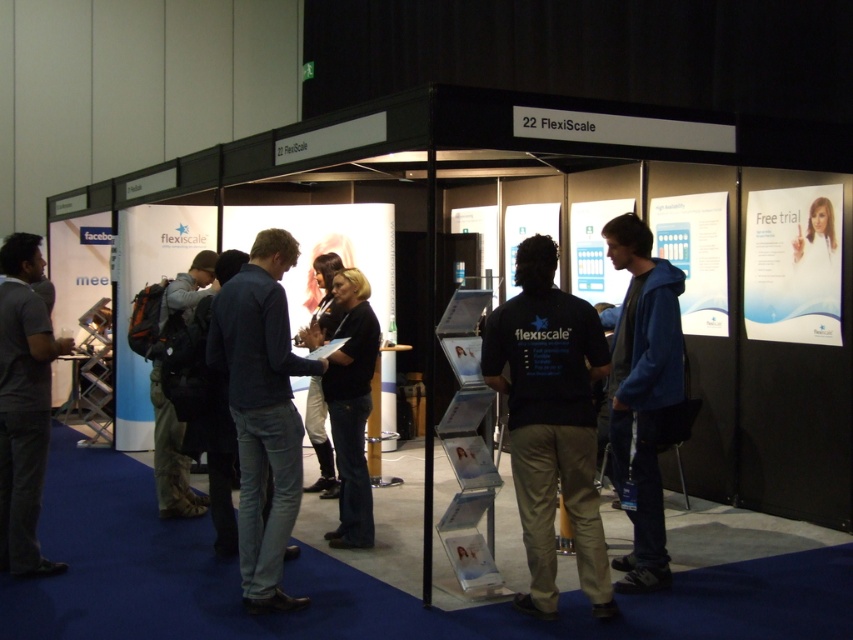
You are a photographer at the trade show and need to take a photo of the FlexiScale booth. The black cotton shirt at center and dark blue jeans at center are both in the frame. Which clothing item will appear taller in the photo?

The dark blue jeans at center will appear taller in the photo because the black cotton shirt at center is shorter than dark blue jeans at center.